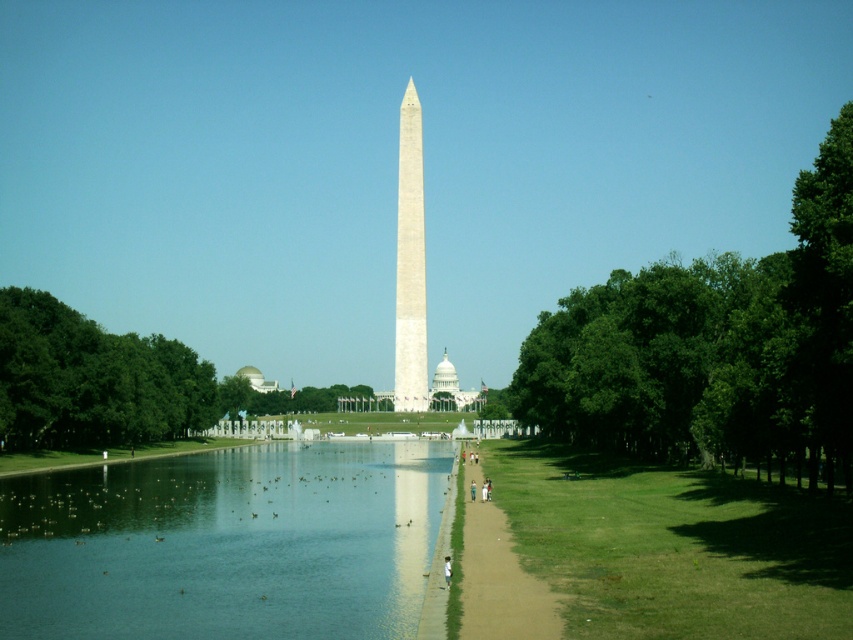
Question: Estimate the real-world distances between objects in this image. Which object is farther from the white cotton pants at center?

Choices:
 (A) green leafy tree at left
 (B) brown dirt path at center
 (C) smooth concrete path at center
 (D) white marble obelisk at center

Answer: (D)

Question: Does green leafy tree at left have a larger size compared to white marble obelisk at center?

Choices:
 (A) no
 (B) yes

Answer: (B)

Question: Is green leafy tree at right above green leafy tree at left?

Choices:
 (A) no
 (B) yes

Answer: (B)

Question: Which object appears farthest from the camera in this image?

Choices:
 (A) brown dirt path at center
 (B) smooth concrete path at center
 (C) white cotton shirt at center
 (D) green leafy tree at left

Answer: (D)

Question: Which object is closer to the camera taking this photo?

Choices:
 (A) green leafy tree at left
 (B) brown dirt path at center
 (C) white cotton shirt at center
 (D) clear glass water at lower left

Answer: (B)

Question: Is green leafy tree at left behind white marble obelisk at center?

Choices:
 (A) yes
 (B) no

Answer: (B)